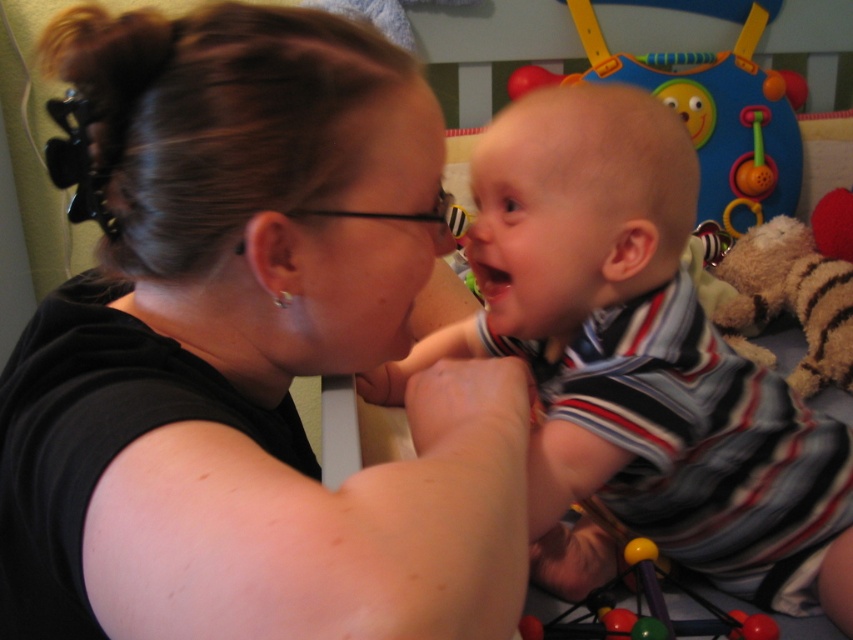
Based on the photo, you are a parent trying to clean the playpen. You need to remove the rubberized plastic beads at lower center first. Can you reach them without moving the plastic colorful activity center at upper center?

The rubberized plastic beads at lower center is behind plastic colorful activity center at upper center, so you cannot reach them without moving the plastic colorful activity center at upper center first.

You are a photographer standing 10 inches away from the black matte shirt at center. Can you take a clear photo of it without moving closer?

The black matte shirt at center is 9.39 inches away from the viewer, so you can take a clear photo without moving closer since you are already within the 10 inches distance.

You are a parent holding a small toy that is 12 inches long. You want to place it between the rubberized plastic beads at lower center and the pink matte mouth at center so that it touches both objects. Is this possible?

The distance between the rubberized plastic beads at lower center and the pink matte mouth at center is 24.56 inches. Since the toy is only 12 inches long, it cannot span the entire distance to touch both objects.